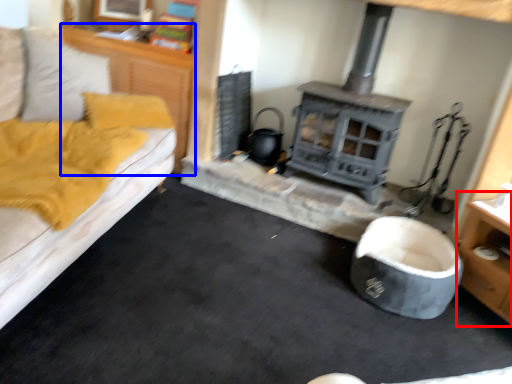
Question: Which object is further to the camera taking this photo, dresser (highlighted by a red box) or dresser (highlighted by a blue box)?

Choices:
 (A) dresser
 (B) dresser

Answer: (B)